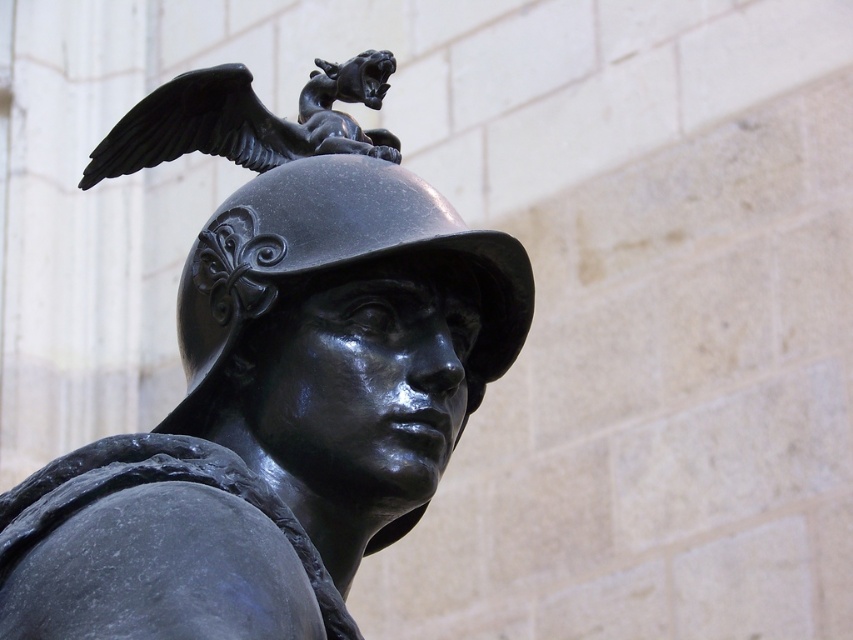
You are an art conservator examining the statue. You notice two helmets on the statue. The first is labeled as the bronze helmet at center, and the second is the shiny black helmet at center. Which helmet is taller?

The bronze helmet at center is taller than the shiny black helmet at center.

You are an art conservator examining the statue. You need to determine which object is bigger between the shiny black helmet at center and the polished bronze eagle at upper center. Which one is larger?

The shiny black helmet at center is larger in size than the polished bronze eagle at upper center.